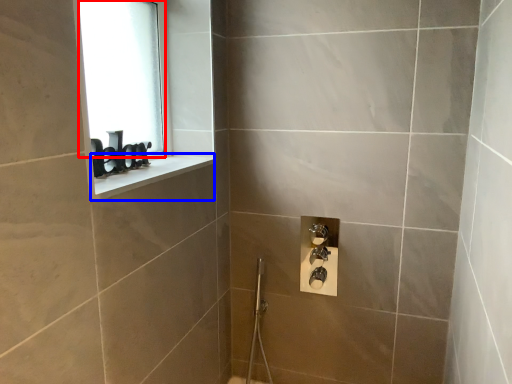
Question: Which object appears closest to the camera in this image, window screen (highlighted by a red box) or window sill (highlighted by a blue box)?

Choices:
 (A) window screen
 (B) window sill

Answer: (B)